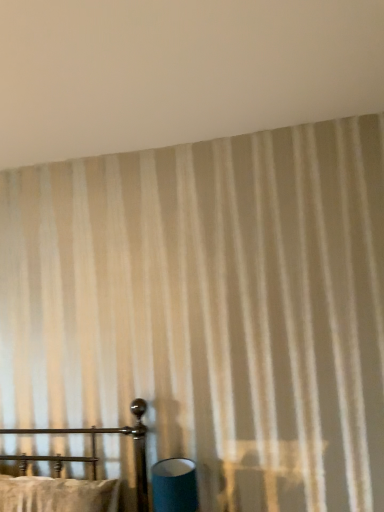
Question: Considering the relative sizes of matte blue cylinder at lower center and beige striped curtain at upper center in the image provided, is matte blue cylinder at lower center smaller than beige striped curtain at upper center?

Choices:
 (A) yes
 (B) no

Answer: (A)

Question: Is the depth of matte blue cylinder at lower center greater than that of beige striped curtain at upper center?

Choices:
 (A) no
 (B) yes

Answer: (B)

Question: Is matte blue cylinder at lower center closer to the viewer compared to beige striped curtain at upper center?

Choices:
 (A) yes
 (B) no

Answer: (B)

Question: Is matte blue cylinder at lower center facing away from beige striped curtain at upper center?

Choices:
 (A) no
 (B) yes

Answer: (A)

Question: From a real-world perspective, is matte blue cylinder at lower center located beneath beige striped curtain at upper center?

Choices:
 (A) no
 (B) yes

Answer: (B)

Question: From the image's perspective, is metal bed frame at lower left above or below beige striped curtain at upper center?

Choices:
 (A) below
 (B) above

Answer: (A)

Question: From a real-world perspective, is metal bed frame at lower left above or below beige striped curtain at upper center?

Choices:
 (A) above
 (B) below

Answer: (B)

Question: From their relative heights in the image, would you say metal bed frame at lower left is taller or shorter than beige striped curtain at upper center?

Choices:
 (A) tall
 (B) short

Answer: (A)

Question: In terms of width, does metal bed frame at lower left look wider or thinner when compared to beige striped curtain at upper center?

Choices:
 (A) wide
 (B) thin

Answer: (B)

Question: Considering the positions of beige striped curtain at upper center and metal bed frame at lower left in the image, is beige striped curtain at upper center taller or shorter than metal bed frame at lower left?

Choices:
 (A) short
 (B) tall

Answer: (A)

Question: From the image's perspective, relative to metal bed frame at lower left, is beige striped curtain at upper center above or below?

Choices:
 (A) above
 (B) below

Answer: (A)

Question: Do you think beige striped curtain at upper center is within metal bed frame at lower left, or outside of it?

Choices:
 (A) outside
 (B) inside

Answer: (A)

Question: From a real-world perspective, is beige striped curtain at upper center positioned above or below metal bed frame at lower left?

Choices:
 (A) below
 (B) above

Answer: (B)

Question: Is matte blue cylinder at lower center taller or shorter than metal bed frame at lower left?

Choices:
 (A) tall
 (B) short

Answer: (B)

Question: Considering the positions of matte blue cylinder at lower center and metal bed frame at lower left in the image, is matte blue cylinder at lower center bigger or smaller than metal bed frame at lower left?

Choices:
 (A) big
 (B) small

Answer: (B)